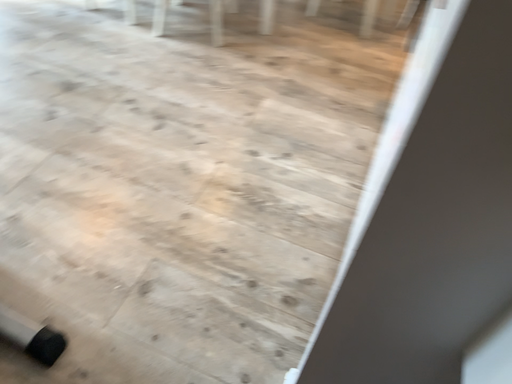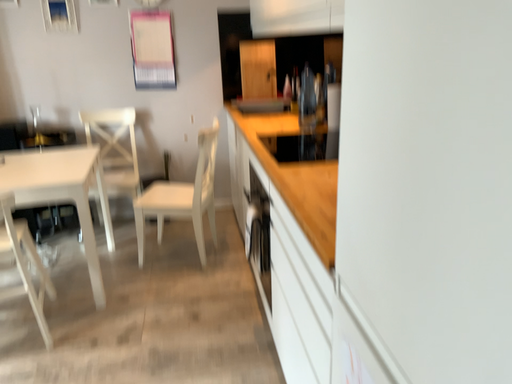
Question: Which way did the camera rotate in the video?

Choices:
 (A) rotated upward
 (B) rotated downward

Answer: (A)